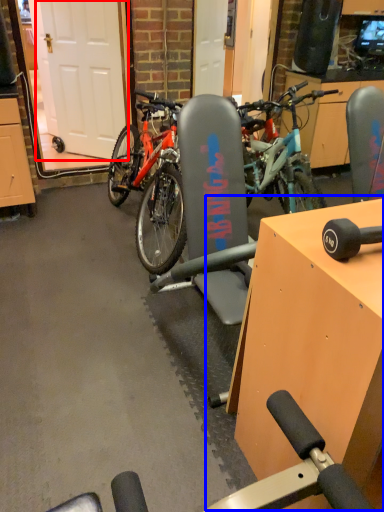
Question: Which of the following is the farthest to the observer, garage door (highlighted by a red box) or table (highlighted by a blue box)?

Choices:
 (A) garage door
 (B) table

Answer: (A)